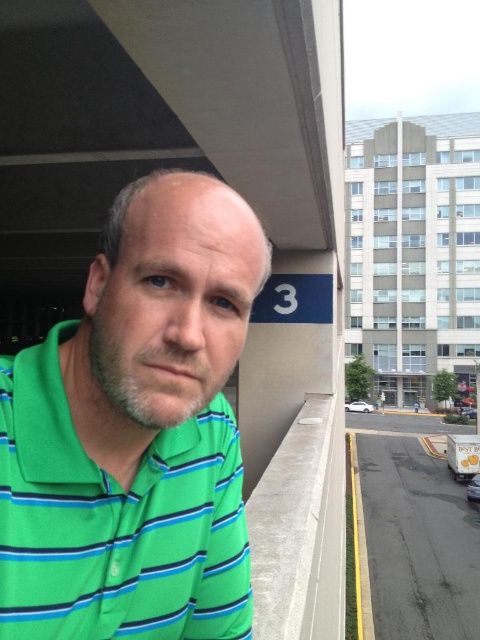
Question: Which is nearer to the white glossy van at lower right?

Choices:
 (A) green striped polo shirt at left
 (B) white matte car at lower right

Answer: (B)

Question: Is green striped polo shirt at left wider than white matte car at lower right?

Choices:
 (A) no
 (B) yes

Answer: (A)

Question: Does white glossy van at lower right have a larger size compared to white matte car at lower right?

Choices:
 (A) no
 (B) yes

Answer: (B)

Question: Does green striped polo shirt at left have a greater width compared to white matte car at lower right?

Choices:
 (A) no
 (B) yes

Answer: (A)

Question: Which point appears farthest from the camera in this image?

Choices:
 (A) (365, 404)
 (B) (80, 372)

Answer: (A)

Question: Estimate the real-world distances between objects in this image. Which object is closer to the white glossy van at lower right?

Choices:
 (A) green striped polo shirt at left
 (B) white matte car at lower right

Answer: (B)